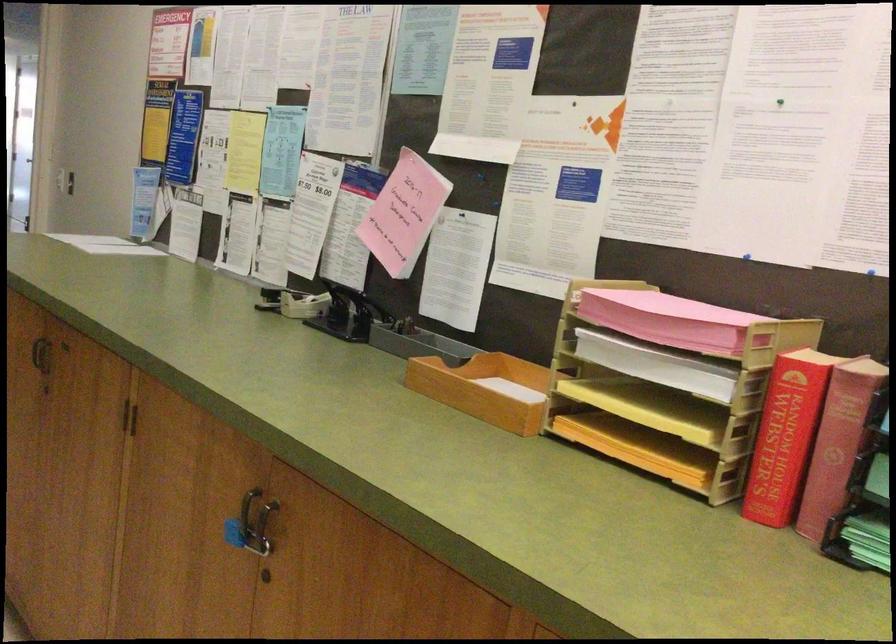
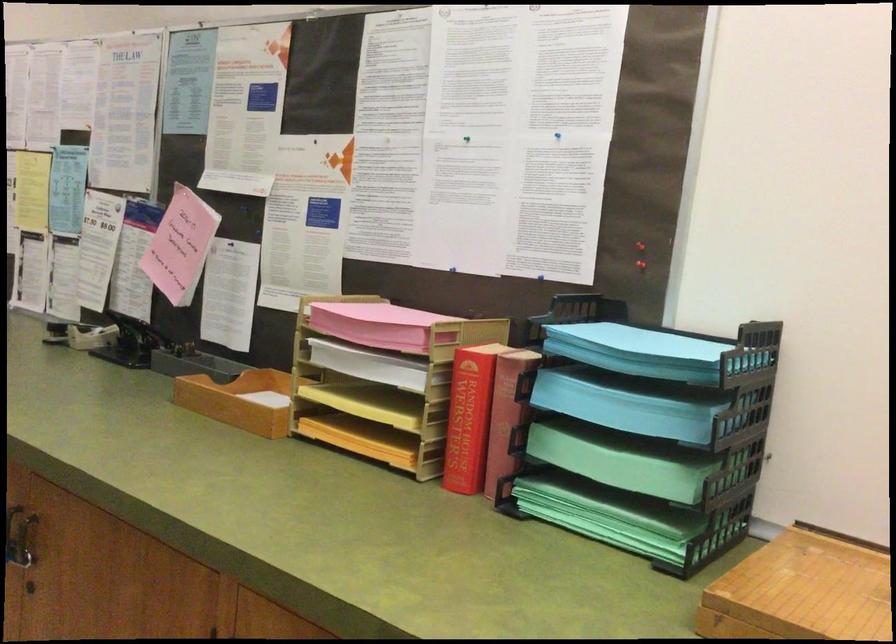
The point at (776, 100) is marked in the first image. Where is the corresponding point in the second image?

(467, 138)